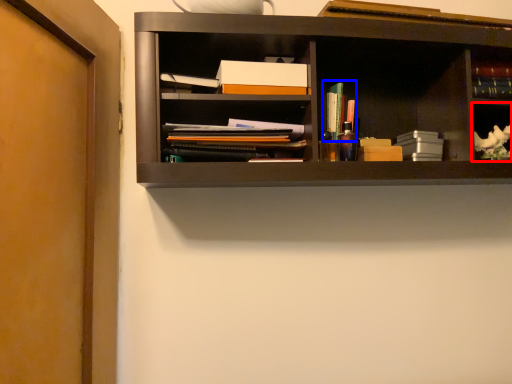
Question: Which object appears closest to the camera in this image, cabinet (highlighted by a red box) or book (highlighted by a blue box)?

Choices:
 (A) cabinet
 (B) book

Answer: (A)